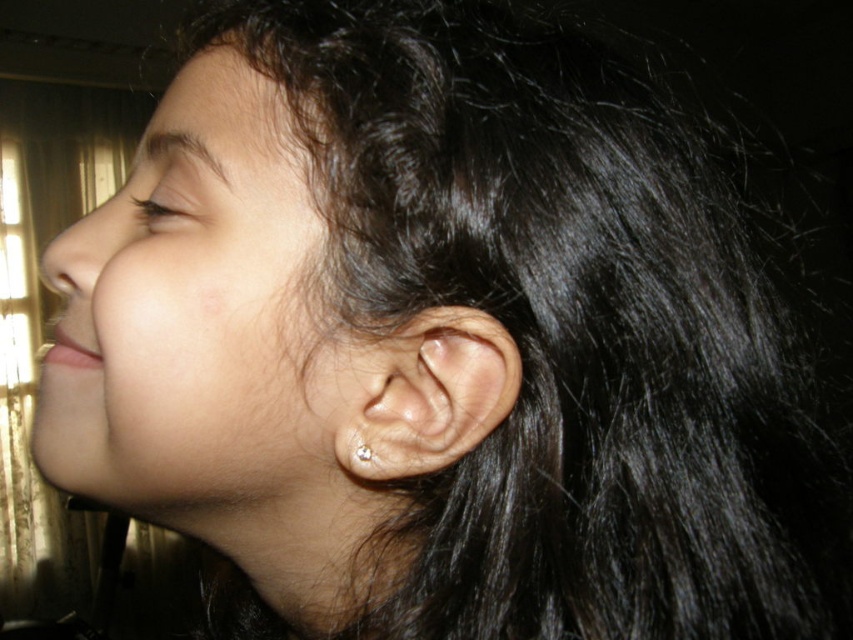
Question: Is clear skin ear at center to the right of clear crystal earring at ear from the viewer's perspective?

Choices:
 (A) yes
 (B) no

Answer: (A)

Question: Which object appears closest to the camera in this image?

Choices:
 (A) clear skin ear at center
 (B) clear crystal earring at ear

Answer: (A)

Question: Is clear skin ear at center positioned at the back of clear crystal earring at ear?

Choices:
 (A) no
 (B) yes

Answer: (A)

Question: Is clear skin ear at center thinner than clear crystal earring at ear?

Choices:
 (A) yes
 (B) no

Answer: (B)